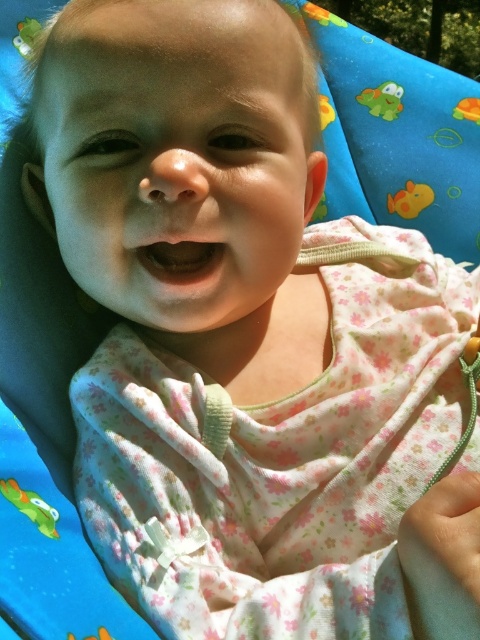
Question: Can you confirm if yellow rubber duck at upper right is positioned to the right of green plastic frog at upper left?

Choices:
 (A) yes
 (B) no

Answer: (A)

Question: Estimate the real-world distances between objects in this image. Which object is farther from the green plastic frog at upper left?

Choices:
 (A) yellow rubber duck at upper right
 (B) pink fabric mouth at center
 (C) green rubber duck at lower left

Answer: (C)

Question: Which object is positioned closest to the green rubber turtle at upper center?

Choices:
 (A) pink fabric mouth at center
 (B) yellow rubber duck at upper right
 (C) green rubber duck at lower left

Answer: (B)

Question: Is pink fabric mouth at center to the right of green plastic frog at upper left from the viewer's perspective?

Choices:
 (A) no
 (B) yes

Answer: (B)

Question: Is green rubber turtle at upper center to the left of yellow rubber duck at upper right from the viewer's perspective?

Choices:
 (A) yes
 (B) no

Answer: (A)

Question: Which object is the farthest from the pink fabric mouth at center?

Choices:
 (A) green rubber turtle at upper center
 (B) green rubber duck at lower left
 (C) yellow rubber duck at upper right
 (D) green plastic frog at upper left

Answer: (A)